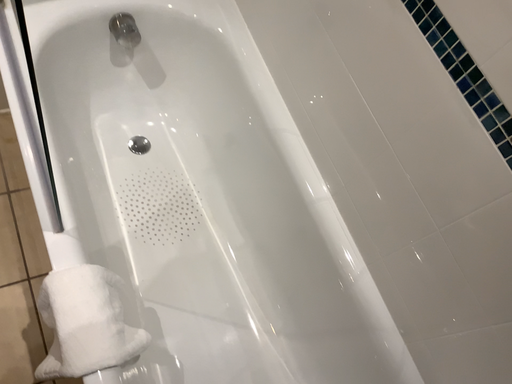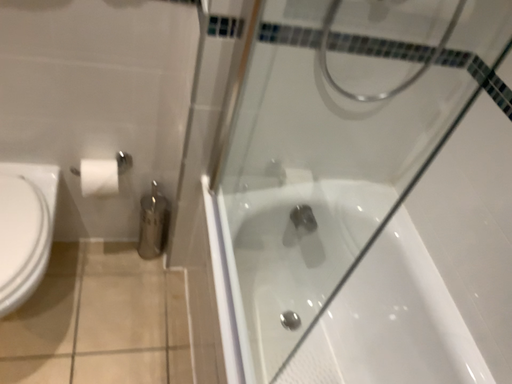
Question: How did the camera likely rotate when shooting the video?

Choices:
 (A) rotated downward
 (B) rotated upward

Answer: (B)